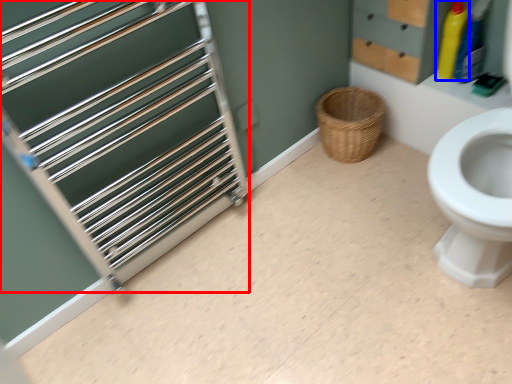
Question: Which of the following is the farthest to the observer, cage (highlighted by a red box) or cleaning product (highlighted by a blue box)?

Choices:
 (A) cage
 (B) cleaning product

Answer: (B)